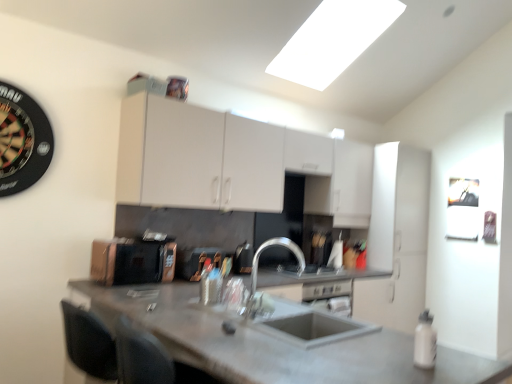
What is the approximate width of concrete gray countertop at center?

concrete gray countertop at center is 93.63 centimeters in width.

The height and width of the screenshot is (384, 512). Identify the location of metallic silver toaster at center, which ranks as the 2th appliance in right-to-left order. (196, 261).

What do you see at coordinates (258, 263) in the screenshot? The height and width of the screenshot is (384, 512). I see `silver metallic faucet at center` at bounding box center [258, 263].

I want to click on satin silver gas stove at center, so click(307, 270).

Considering the relative sizes of matte copper toaster at center, which is the first appliance from left to right, and white matte bottle at lower right in the image provided, is matte copper toaster at center, which is the first appliance from left to right, shorter than white matte bottle at lower right?

No.

Considering the positions of objects matte copper toaster at center, which appears as the third appliance when viewed from the right, and white matte bottle at lower right in the image provided, who is behind, matte copper toaster at center, which appears as the third appliance when viewed from the right, or white matte bottle at lower right?

matte copper toaster at center, which appears as the third appliance when viewed from the right, is more distant.

Between matte copper toaster at center, which appears as the third appliance when viewed from the right, and white matte bottle at lower right, which one has larger width?

matte copper toaster at center, which appears as the third appliance when viewed from the right.

You are a GUI agent. You are given a task and a screenshot of the screen. Output one action in this format:
    pyautogui.click(x=<x>, y=<y>)
    Task: Click on the countertop on the left side of white matte bottle at lower right
    This screenshot has height=384, width=512.
    Given the screenshot: What is the action you would take?
    pyautogui.click(x=277, y=344)

Is concrete gray countertop at center closer to camera compared to white matte bottle at lower right?

Yes, it is in front of white matte bottle at lower right.

Is concrete gray countertop at center oriented towards white matte bottle at lower right?

No, concrete gray countertop at center is not oriented towards white matte bottle at lower right.

How different are the orientations of concrete gray countertop at center and white matte bottle at lower right in degrees?

0.000598 degrees separate the facing orientations of concrete gray countertop at center and white matte bottle at lower right.

Who is shorter, silver metallic faucet at center or white matte cabinet at upper center, the 1th cabinetry from the left?

Standing shorter between the two is silver metallic faucet at center.

Is point (286, 242) farther from camera compared to point (334, 146)?

No.

From the image's perspective, is silver metallic faucet at center below white matte cabinet at upper center, the 1th cabinetry from the left?

Indeed, from the image's perspective, silver metallic faucet at center is shown beneath white matte cabinet at upper center, the 1th cabinetry from the left.

Does silver metallic faucet at center appear on the right side of white matte cabinet at upper center, the second cabinetry positioned from the right?

No, silver metallic faucet at center is not to the right of white matte cabinet at upper center, the second cabinetry positioned from the right.

From the image's perspective, which object appears higher, white matte cabinet at upper center, the second cabinetry positioned from the right, or white matte cabinet at center, which is counted as the 2th cabinetry, starting from the left?

white matte cabinet at upper center, the second cabinetry positioned from the right, from the image's perspective.

Which object is more forward, white matte cabinet at upper center, the 1th cabinetry from the left, or white matte cabinet at center, the 1th cabinetry from the right?

white matte cabinet at upper center, the 1th cabinetry from the left, is more forward.

Can we say white matte cabinet at upper center, the second cabinetry positioned from the right, lies outside white matte cabinet at center, the 1th cabinetry from the right?

Yes, white matte cabinet at upper center, the second cabinetry positioned from the right, is not within white matte cabinet at center, the 1th cabinetry from the right.

Measure the distance between white matte cabinet at upper center, the 1th cabinetry from the left, and white matte cabinet at center, which is counted as the 2th cabinetry, starting from the left.

white matte cabinet at upper center, the 1th cabinetry from the left, is 34.56 inches from white matte cabinet at center, which is counted as the 2th cabinetry, starting from the left.

Are white matte cabinet at upper center, the second cabinetry positioned from the right, and metallic silver toaster at center, which ranks as the 2th appliance in right-to-left order, located far from each other?

They are positioned close to each other.

Considering the relative sizes of white matte cabinet at upper center, the 1th cabinetry from the left, and metallic silver toaster at center, which ranks as the 2th appliance in right-to-left order, in the image provided, is white matte cabinet at upper center, the 1th cabinetry from the left, smaller than metallic silver toaster at center, which ranks as the 2th appliance in right-to-left order,?

Incorrect, white matte cabinet at upper center, the 1th cabinetry from the left, is not smaller in size than metallic silver toaster at center, which ranks as the 2th appliance in right-to-left order.

Considering the relative sizes of white matte cabinet at upper center, the 1th cabinetry from the left, and metallic silver toaster at center, which ranks as the 2th appliance in right-to-left order, in the image provided, is white matte cabinet at upper center, the 1th cabinetry from the left, shorter than metallic silver toaster at center, which ranks as the 2th appliance in right-to-left order,?

No.

From the image's perspective, between white matte cabinet at upper center, the second cabinetry positioned from the right, and metallic silver toaster at center, the 2th appliance in the left-to-right sequence, who is located below?

From the image's view, metallic silver toaster at center, the 2th appliance in the left-to-right sequence, is below.

From a real-world perspective, is white matte cabinet at center, which is counted as the 2th cabinetry, starting from the left, positioned under metallic silver toaster at center, the 2th appliance in the left-to-right sequence, based on gravity?

No.

Can you see white matte cabinet at center, the 1th cabinetry from the right, touching metallic silver toaster at center, which ranks as the 2th appliance in right-to-left order?

No, white matte cabinet at center, the 1th cabinetry from the right, is not touching metallic silver toaster at center, which ranks as the 2th appliance in right-to-left order.

Is point (403, 232) more distant than point (185, 268)?

Yes, point (403, 232) is farther from viewer.

From the image's perspective, which is below, white matte cabinet at center, the 1th cabinetry from the right, or metallic silver toaster at center, the 2th appliance in the left-to-right sequence?

white matte cabinet at center, the 1th cabinetry from the right, appears lower in the image.

Based on the photo, from a real-world perspective, is metallic silver toaster at center, which ranks as the 2th appliance in right-to-left order, above or below silver metallic faucet at center?

In terms of real-world spatial position, metallic silver toaster at center, which ranks as the 2th appliance in right-to-left order, is below silver metallic faucet at center.

Is the surface of metallic silver toaster at center, which ranks as the 2th appliance in right-to-left order, in direct contact with silver metallic faucet at center?

There is a gap between metallic silver toaster at center, which ranks as the 2th appliance in right-to-left order, and silver metallic faucet at center.

Locate an element on the screen. The width and height of the screenshot is (512, 384). bottle below the matte copper toaster at center, which is the first appliance from left to right (from the image's perspective) is located at coordinates (425, 341).

The image size is (512, 384). In order to click on countertop that appears on the left of white matte bottle at lower right in this screenshot , I will do `click(277, 344)`.

Looking at the image, which one is located closer to white matte cabinet at upper center, the second cabinetry positioned from the right, satin silver gas stove at center or white matte cabinet at center, the 1th cabinetry from the right?

white matte cabinet at center, the 1th cabinetry from the right, lies closer to white matte cabinet at upper center, the second cabinetry positioned from the right, than the other object.

Considering their positions, is white matte cabinet at center, which is counted as the 2th cabinetry, starting from the left, positioned further to white matte bottle at lower right than metallic silver toaster at center, which ranks as the 2th appliance in right-to-left order?

white matte cabinet at center, which is counted as the 2th cabinetry, starting from the left, is positioned further to the anchor white matte bottle at lower right.

Estimate the real-world distances between objects in this image. Which object is closer to metallic silver toaster at center, the 2th appliance in the left-to-right sequence, matte copper toaster at center, which appears as the third appliance when viewed from the right, or white matte bottle at lower right?

matte copper toaster at center, which appears as the third appliance when viewed from the right, is closer to metallic silver toaster at center, the 2th appliance in the left-to-right sequence.

From the image, which object appears to be nearer to metallic silver toaster at center, the 2th appliance in the left-to-right sequence, matte copper toaster at center, which appears as the third appliance when viewed from the right, or satin nickel faucet at center, the first appliance in the right-to-left sequence?

Among the two, matte copper toaster at center, which appears as the third appliance when viewed from the right, is located nearer to metallic silver toaster at center, the 2th appliance in the left-to-right sequence.

Which object lies further to the anchor point concrete gray countertop at center, satin nickel faucet at center, the first appliance in the right-to-left sequence, or white matte cabinet at center, which is counted as the 2th cabinetry, starting from the left?

Among the two, white matte cabinet at center, which is counted as the 2th cabinetry, starting from the left, is located further to concrete gray countertop at center.

From the image, which object appears to be nearer to metallic silver toaster at center, which ranks as the 2th appliance in right-to-left order, white matte bottle at lower right or matte copper toaster at center, which is the first appliance from left to right?

Among the two, matte copper toaster at center, which is the first appliance from left to right, is located nearer to metallic silver toaster at center, which ranks as the 2th appliance in right-to-left order.

Looking at the image, which one is located closer to satin nickel faucet at center, the first appliance in the right-to-left sequence, matte copper toaster at center, which appears as the third appliance when viewed from the right, or white matte cabinet at center, the 1th cabinetry from the right?

Among the two, matte copper toaster at center, which appears as the third appliance when viewed from the right, is located nearer to satin nickel faucet at center, the first appliance in the right-to-left sequence.

Based on their spatial positions, is satin nickel faucet at center, the first appliance in the right-to-left sequence, or white matte cabinet at upper center, the second cabinetry positioned from the right, further from silver metallic faucet at center?

Among the two, white matte cabinet at upper center, the second cabinetry positioned from the right, is located further to silver metallic faucet at center.

The height and width of the screenshot is (384, 512). What are the coordinates of `faucet between white matte bottle at lower right and satin nickel faucet at center, the first appliance in the right-to-left sequence, in the front-back direction` in the screenshot? It's located at (258, 263).

Locate an element on the screen. The image size is (512, 384). gas stove between satin nickel faucet at center, the first appliance in the right-to-left sequence, and white matte cabinet at center, which is counted as the 2th cabinetry, starting from the left is located at coordinates (307, 270).

You are a GUI agent. You are given a task and a screenshot of the screen. Output one action in this format:
    pyautogui.click(x=<x>, y=<y>)
    Task: Click on the cabinetry between white matte bottle at lower right and satin silver gas stove at center in the front-back direction
    
    Given the screenshot: What is the action you would take?
    pyautogui.click(x=233, y=162)

Where is `faucet between matte copper toaster at center, which appears as the third appliance when viewed from the right, and white matte cabinet at upper center, the second cabinetry positioned from the right, from left to right`? The width and height of the screenshot is (512, 384). faucet between matte copper toaster at center, which appears as the third appliance when viewed from the right, and white matte cabinet at upper center, the second cabinetry positioned from the right, from left to right is located at coordinates (258, 263).